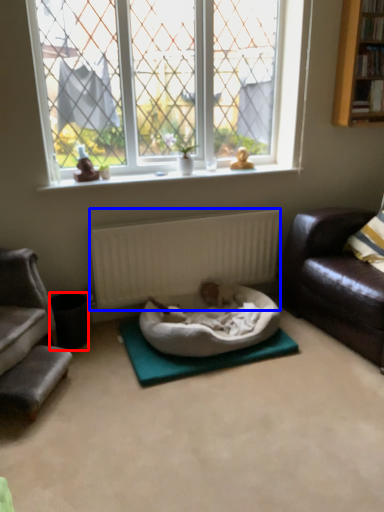
Question: Which object is closer to the camera taking this photo, trash bin/can (highlighted by a red box) or radiator (highlighted by a blue box)?

Choices:
 (A) trash bin/can
 (B) radiator

Answer: (A)